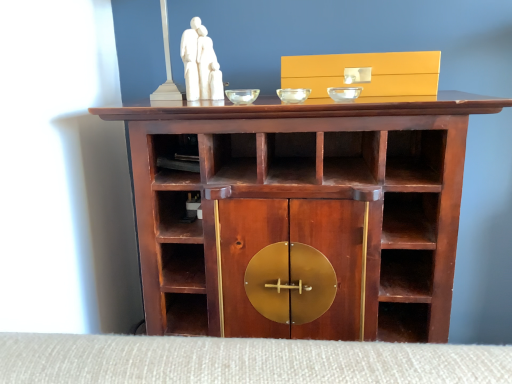
Question: From a real-world perspective, is transparent glass bowl at center, which ranks as the 3th glass bowl in left-to-right order, positioned above or below transparent glass bowl at center, placed as the 1th glass bowl when sorted from left to right?

Choices:
 (A) below
 (B) above

Answer: (B)

Question: Is transparent glass bowl at center, which ranks as the 3th glass bowl in left-to-right order, to the left or to the right of transparent glass bowl at center, placed as the 1th glass bowl when sorted from left to right, in the image?

Choices:
 (A) left
 (B) right

Answer: (B)

Question: Estimate the real-world distances between objects in this image. Which object is farther from the transparent glass bowl at center, positioned as the second glass bowl in right-to-left order?

Choices:
 (A) transparent glass bowl at center, which ranks as the 3th glass bowl in left-to-right order
 (B) matte gold drawer at upper center
 (C) white marble sculpture at upper center
 (D) transparent glass bowl at center, placed as the 1th glass bowl when sorted from left to right
 (E) mahogany wood cabinet at center

Answer: (E)

Question: Which object is positioned closest to the mahogany wood cabinet at center?

Choices:
 (A) transparent glass bowl at center, which appears as the 3th glass bowl when viewed from the right
 (B) matte gold drawer at upper center
 (C) transparent glass bowl at center, which ranks as the 3th glass bowl in left-to-right order
 (D) transparent glass bowl at center, positioned as the second glass bowl in right-to-left order
 (E) white marble sculpture at upper center

Answer: (B)